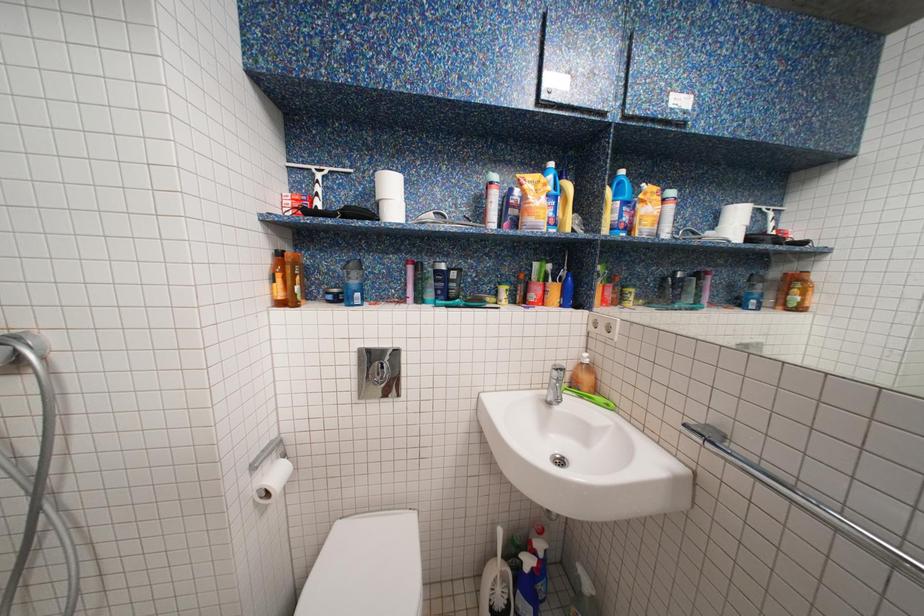
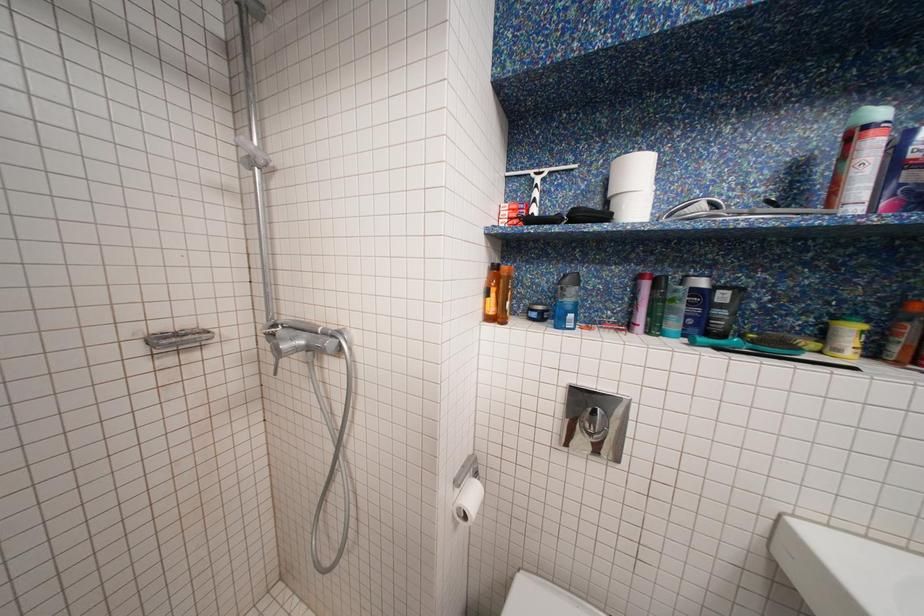
Question: The camera is either moving clockwise (left) or counter-clockwise (right) around the object. The first image is from the beginning of the video and the second image is from the end. Is the camera moving left or right when shooting the video?

Choices:
 (A) Left
 (B) Right

Answer: (B)